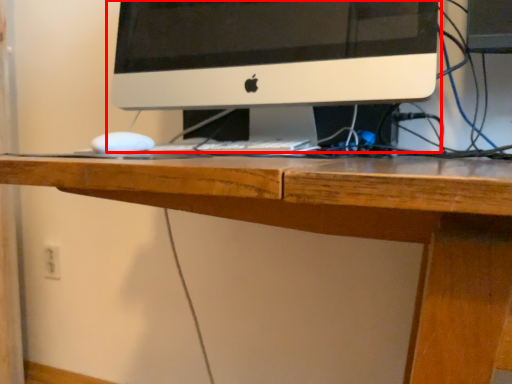
Question: From the image's perspective, where is computer monitor (annotated by the red box) located relative to electric outlet?

Choices:
 (A) below
 (B) above

Answer: (B)